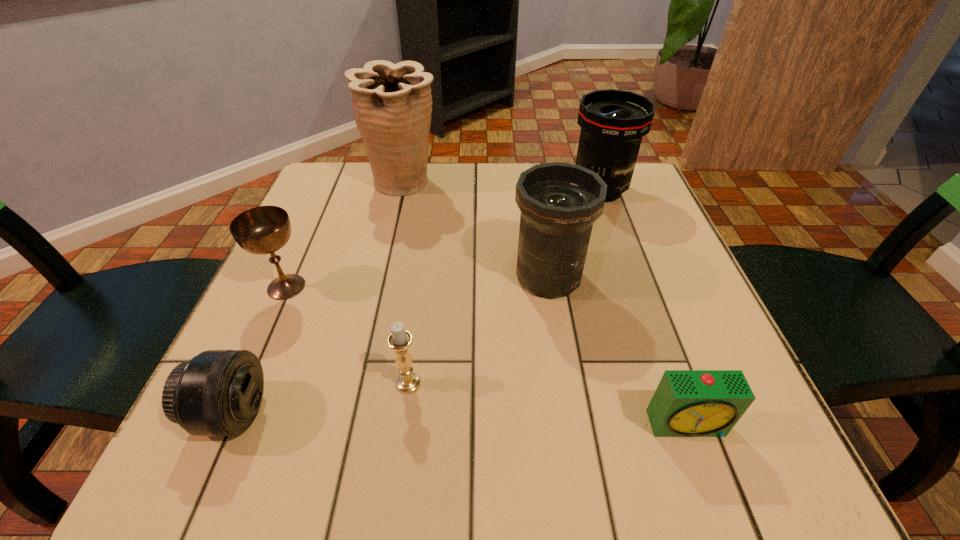
Where is `vacant area that lies between the nearest telephoto lens and the chalice`? vacant area that lies between the nearest telephoto lens and the chalice is located at coordinates (259, 350).

Find the location of a particular element. The height and width of the screenshot is (540, 960). free point between the tallest object and the rightmost telephoto lens is located at coordinates pos(501,187).

In order to click on free space between the nearest telephoto lens and the alarm clock in this screenshot , I will do `click(460, 418)`.

You are a GUI agent. You are given a task and a screenshot of the screen. Output one action in this format:
    pyautogui.click(x=<x>, y=<y>)
    Task: Click on the object that is the fourth closest to the farthest telephoto lens
    The image size is (960, 540).
    Given the screenshot: What is the action you would take?
    pyautogui.click(x=399, y=340)

Choose which object is the fourth nearest neighbor to the alarm clock. Please provide its 2D coordinates. Your answer should be formatted as a tuple, i.e. [(x, y)], where the tuple contains the x and y coordinates of a point satisfying the conditions above.

[(218, 392)]

Identify the location of telephoto lens that is the second closest to the fifth object from left to right. Image resolution: width=960 pixels, height=540 pixels. (218, 392).

Identify which telephoto lens is located as the second nearest to the farthest telephoto lens. Please provide its 2D coordinates. Your answer should be formatted as a tuple, i.e. [(x, y)], where the tuple contains the x and y coordinates of a point satisfying the conditions above.

[(218, 392)]

The width and height of the screenshot is (960, 540). Find the location of `vacant area in the image that satisfies the following two spatial constraints: 1. on the back side of the candle holder; 2. on the left side of the second farthest telephoto lens`. vacant area in the image that satisfies the following two spatial constraints: 1. on the back side of the candle holder; 2. on the left side of the second farthest telephoto lens is located at coordinates (422, 277).

I want to click on vacant area that satisfies the following two spatial constraints: 1. on the front side of the second farthest telephoto lens; 2. on the right side of the tallest object, so click(x=381, y=277).

Where is `vacant region that satisfies the following two spatial constraints: 1. on the front side of the second telephoto lens from left to right; 2. on the right side of the urn`? The width and height of the screenshot is (960, 540). vacant region that satisfies the following two spatial constraints: 1. on the front side of the second telephoto lens from left to right; 2. on the right side of the urn is located at coordinates (381, 277).